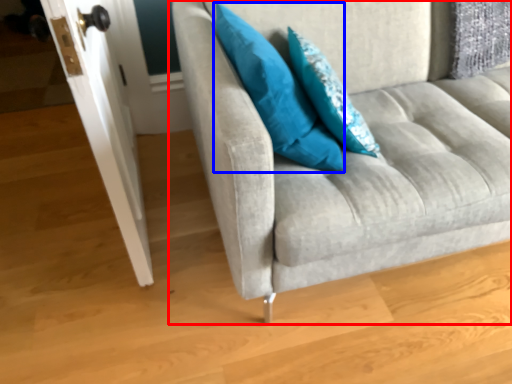
Question: Which point is closer to the camera, studio couch (highlighted by a red box) or pillow (highlighted by a blue box)?

Choices:
 (A) studio couch
 (B) pillow

Answer: (A)